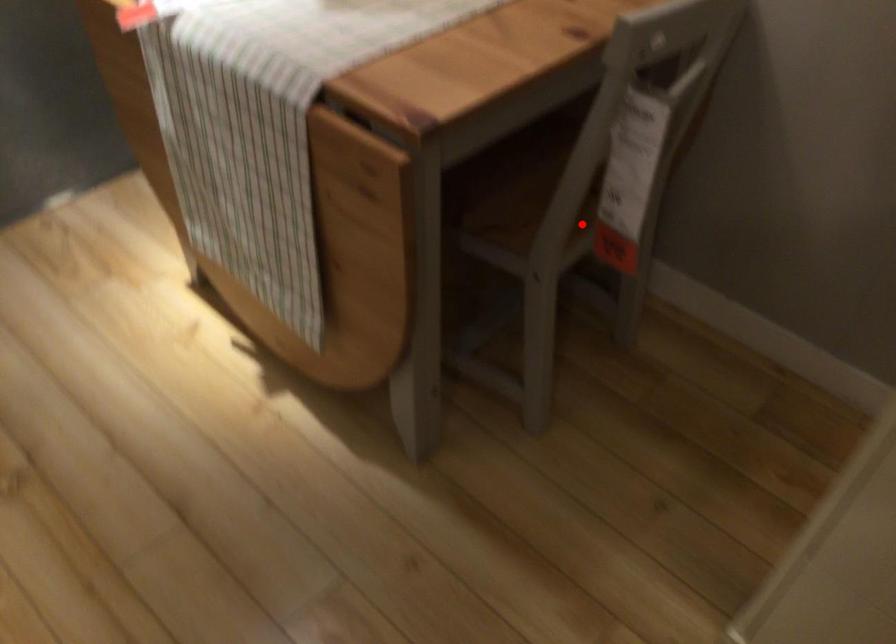
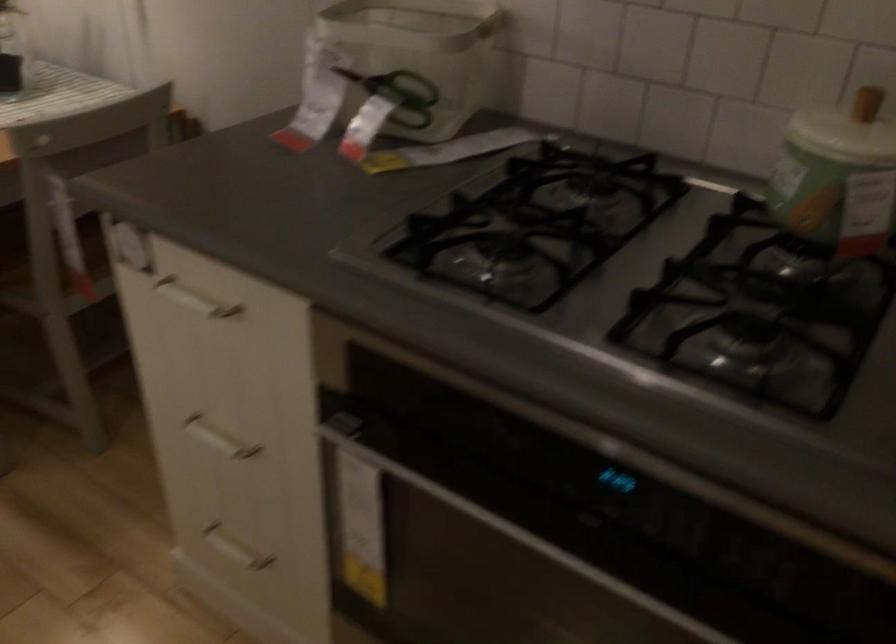
Where in the second image is the point corresponding to the highlighted location from the first image?

(54, 270)